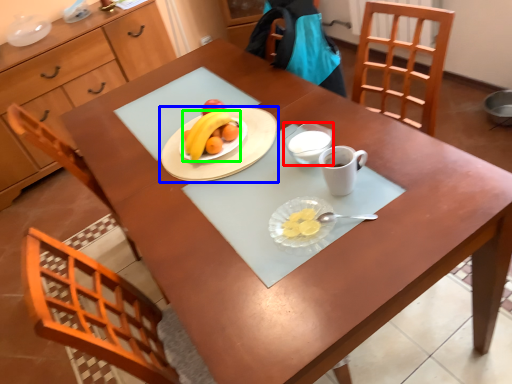
Question: Which object is positioned farthest from glass bowl (highlighted by a red box)? Select from tableware (highlighted by a blue box) and grapefruit (highlighted by a green box).

Choices:
 (A) tableware
 (B) grapefruit

Answer: (B)